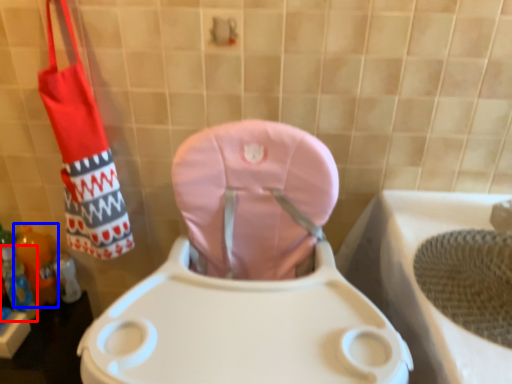
Question: Among these objects, which one is nearest to the camera, bottle (highlighted by a red box) or bottle (highlighted by a blue box)?

Choices:
 (A) bottle
 (B) bottle

Answer: (A)